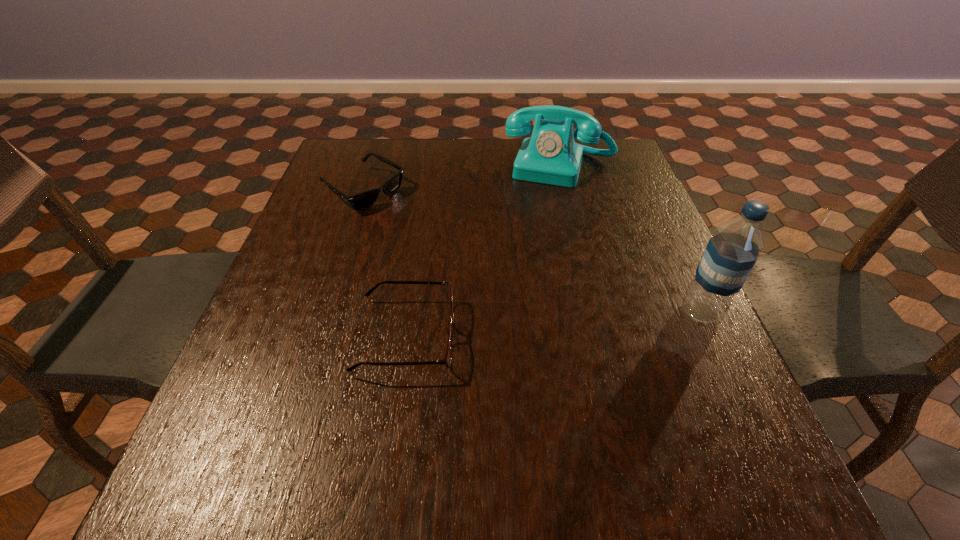
Locate an element on the screen. telephone located in the right edge section of the desktop is located at coordinates (550, 156).

Find the location of a particular element. This screenshot has width=960, height=540. object that is at the far left corner is located at coordinates (363, 200).

At what (x,y) coordinates should I click in order to perform the action: click on object present at the far right corner. Please return your answer as a coordinate pair (x, y). The width and height of the screenshot is (960, 540). Looking at the image, I should click on (550, 156).

Locate an element on the screen. This screenshot has height=540, width=960. free location at the far edge of the desktop is located at coordinates 438,150.

The height and width of the screenshot is (540, 960). Find the location of `free space at the left edge of the desktop`. free space at the left edge of the desktop is located at coordinates (296, 314).

Locate an element on the screen. This screenshot has height=540, width=960. free spot at the right edge of the desktop is located at coordinates (635, 269).

In the image, there is a desktop. Where is `free space at the far left corner`? This screenshot has width=960, height=540. free space at the far left corner is located at coordinates (361, 142).

Where is `free space at the near left corner of the desktop`? Image resolution: width=960 pixels, height=540 pixels. free space at the near left corner of the desktop is located at coordinates (251, 414).

Locate an element on the screen. Image resolution: width=960 pixels, height=540 pixels. blank area at the near right corner is located at coordinates (670, 407).

You are a GUI agent. You are given a task and a screenshot of the screen. Output one action in this format:
    pyautogui.click(x=<x>, y=<y>)
    Task: Click on the vacant space in between the sunglasses and the third object from left to right
    
    Given the screenshot: What is the action you would take?
    pyautogui.click(x=462, y=179)